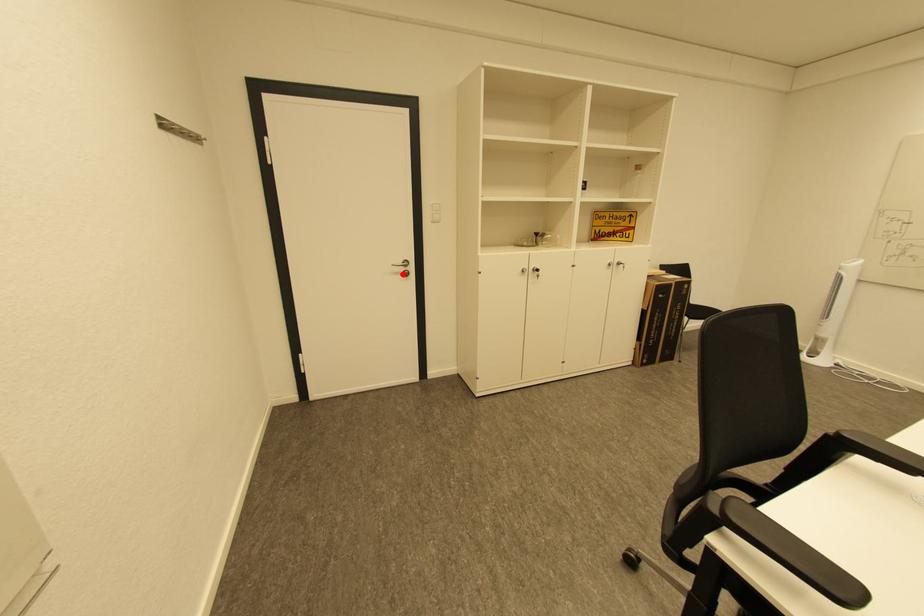
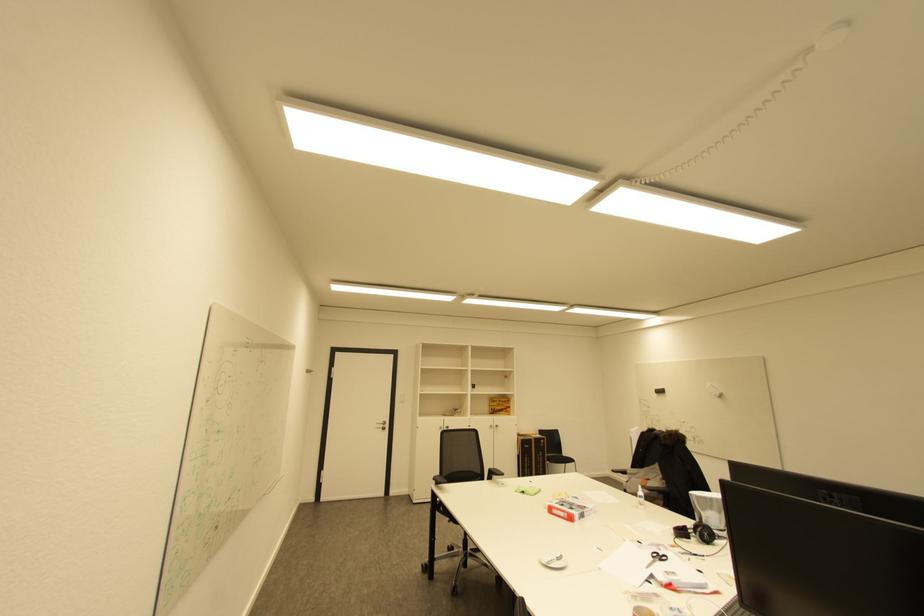
Question: I am providing you with two images of the same scene from different viewpoints. In image1, a red point is highlighted. Considering the same 3D point in image2, which of the following is correct?

Choices:
 (A) It is closer
 (B) It is farther

Answer: (B)